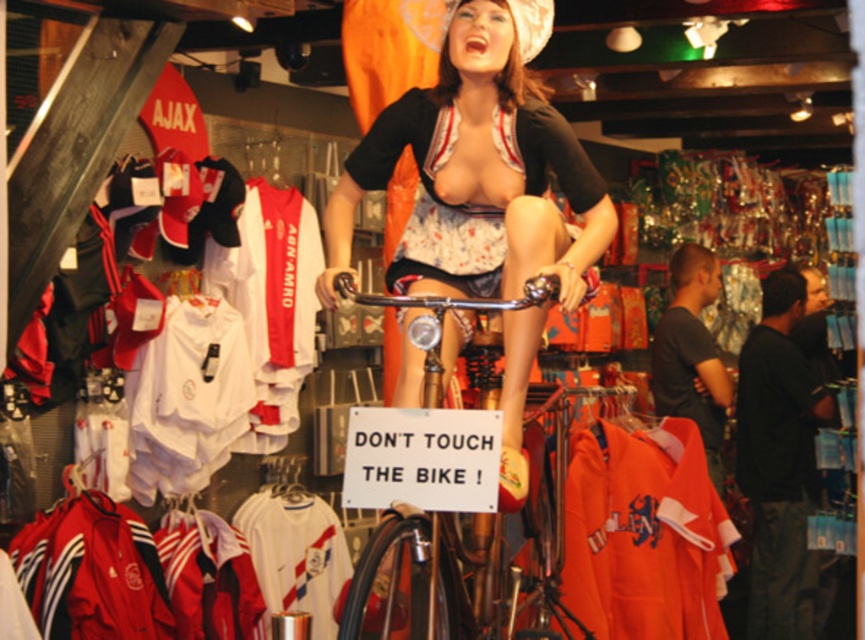
You are a customer in the Ajax sports store and want to locate the orange fabric hoodie at center. According to the store layout, where would you find it?

The orange fabric hoodie at center is located at point 0.836 on the x axis and 0.746 on the y axis.

You are a customer in the Ajax sports store and want to buy both the matte black bicycle at center and the orange fabric hoodie at center. However, you notice something unusual about their arrangement. What do you observe about their positions?

The matte black bicycle at center is positioned over the orange fabric hoodie at center, meaning the bicycle is placed directly on top of the hoodie, making it inaccessible unless the bicycle is moved.